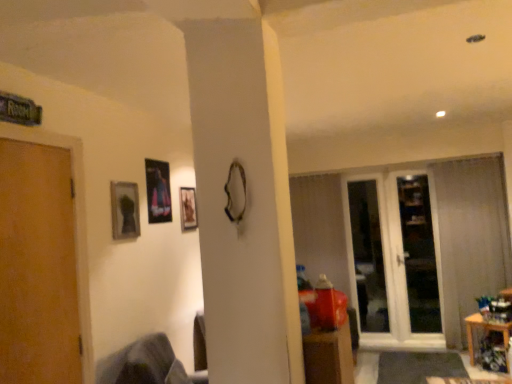
The image size is (512, 384). Describe the element at coordinates (158, 191) in the screenshot. I see `metallic glossy picture frame at upper center, positioned as the 2th picture frame in right-to-left order` at that location.

Where is `wooden table at lower right`? wooden table at lower right is located at coordinates (484, 329).

Describe the element at coordinates (188, 208) in the screenshot. I see `wooden picture frame at center, which is the first picture frame in back-to-front order` at that location.

What do you see at coordinates (391, 262) in the screenshot? I see `transparent glass door at right` at bounding box center [391, 262].

This screenshot has height=384, width=512. What do you see at coordinates (38, 267) in the screenshot?
I see `wooden door at left` at bounding box center [38, 267].

Identify the location of metallic glossy picture frame at upper center, positioned as the 2th picture frame in right-to-left order. The width and height of the screenshot is (512, 384). (158, 191).

Can you tell me how much metallic glossy picture frame at upper center, positioned as the 2th picture frame in right-to-left order, and transparent glass door at right differ in facing direction?

The facing directions of metallic glossy picture frame at upper center, positioned as the 2th picture frame in right-to-left order, and transparent glass door at right are 90 degrees apart.

Is metallic glossy picture frame at upper center, arranged as the second picture frame when viewed from the back, positioned with its back to transparent glass door at right?

No.

Is point (161, 195) in front of point (347, 231)?

Yes, it is.

Is metallic glossy picture frame at upper center, arranged as the second picture frame when viewed from the back, not close to transparent glass door at right?

Yes, metallic glossy picture frame at upper center, arranged as the second picture frame when viewed from the back, is far from transparent glass door at right.

Who is shorter, wooden table at lower right or white plastic screen door at right?

With less height is wooden table at lower right.

Is wooden table at lower right thinner than white plastic screen door at right?

No, wooden table at lower right is not thinner than white plastic screen door at right.

Do you think wooden table at lower right is within white plastic screen door at right, or outside of it?

wooden table at lower right is located beyond the bounds of white plastic screen door at right.

From a real-world perspective, is wooden table at lower right positioned under white plastic screen door at right based on gravity?

Yes, from a real-world perspective, wooden table at lower right is under white plastic screen door at right.

From the image's perspective, would you say white plastic screen door at right is positioned over matte glass picture frame at upper left, which ranks as the first picture frame in left-to-right order?

No.

Between white plastic screen door at right and matte glass picture frame at upper left, the 1th picture frame from the front, which one appears on the right side from the viewer's perspective?

white plastic screen door at right.

Is matte glass picture frame at upper left, the 1th picture frame from the front, surrounded by white plastic screen door at right?

No, matte glass picture frame at upper left, the 1th picture frame from the front, is located outside of white plastic screen door at right.

Which object is closer to the camera taking this photo, wooden table at lower right or metallic glossy picture frame at upper center, which ranks as the second picture frame in front-to-back order?

metallic glossy picture frame at upper center, which ranks as the second picture frame in front-to-back order, is in front.

From a real-world perspective, which object rests below the other?

wooden table at lower right.

Is wooden table at lower right bigger or smaller than metallic glossy picture frame at upper center, which ranks as the second picture frame in front-to-back order?

Considering their sizes, wooden table at lower right takes up more space than metallic glossy picture frame at upper center, which ranks as the second picture frame in front-to-back order.

In terms of width, does wooden picture frame at center, which ranks as the third picture frame in front-to-back order, look wider or thinner when compared to white plastic screen door at right?

Clearly, wooden picture frame at center, which ranks as the third picture frame in front-to-back order, has less width compared to white plastic screen door at right.

Considering the positions of objects wooden picture frame at center, which is the first picture frame in back-to-front order, and white plastic screen door at right in the image provided, who is behind, wooden picture frame at center, which is the first picture frame in back-to-front order, or white plastic screen door at right?

white plastic screen door at right is more distant.

Is point (197, 219) in front of point (366, 259)?

Yes, point (197, 219) is in front of point (366, 259).

Is wooden picture frame at center, positioned as the first picture frame in right-to-left order, facing away from white plastic screen door at right?

No, wooden picture frame at center, positioned as the first picture frame in right-to-left order,'s orientation is not away from white plastic screen door at right.

Which is further, (128, 233) or (153, 184)?

Positioned behind is point (153, 184).

Is matte glass picture frame at upper left, which ranks as the first picture frame in left-to-right order, spatially inside metallic glossy picture frame at upper center, arranged as the second picture frame when viewed from the back, or outside of it?

matte glass picture frame at upper left, which ranks as the first picture frame in left-to-right order, is outside metallic glossy picture frame at upper center, arranged as the second picture frame when viewed from the back.

Can you confirm if matte glass picture frame at upper left, the 1th picture frame from the front, is thinner than metallic glossy picture frame at upper center, the 2th picture frame when ordered from left to right?

In fact, matte glass picture frame at upper left, the 1th picture frame from the front, might be wider than metallic glossy picture frame at upper center, the 2th picture frame when ordered from left to right.

Is matte glass picture frame at upper left, which ranks as the first picture frame in left-to-right order, taller than metallic glossy picture frame at upper center, positioned as the 2th picture frame in right-to-left order?

Incorrect, the height of matte glass picture frame at upper left, which ranks as the first picture frame in left-to-right order, is not larger of that of metallic glossy picture frame at upper center, positioned as the 2th picture frame in right-to-left order.

Considering the points (120, 368) and (116, 202), which point is in front, point (120, 368) or point (116, 202)?

The point (120, 368) is closer.

How much distance is there between dark gray fabric swivel chair at lower left and matte glass picture frame at upper left, which appears as the 3th picture frame when viewed from the back?

dark gray fabric swivel chair at lower left is 30.75 inches from matte glass picture frame at upper left, which appears as the 3th picture frame when viewed from the back.

In the scene shown: From a real-world perspective, which object rests below the other?

dark gray fabric swivel chair at lower left, from a real-world perspective.

Image resolution: width=512 pixels, height=384 pixels. In order to click on swivel chair below the matte glass picture frame at upper left, which is the third picture frame in right-to-left order (from the image's perspective) in this screenshot , I will do `click(146, 364)`.

You are a GUI agent. You are given a task and a screenshot of the screen. Output one action in this format:
    pyautogui.click(x=<x>, y=<y>)
    Task: Click on the 2nd picture frame in front of the transparent glass door at right, starting your count from the anchor
    The image size is (512, 384).
    Given the screenshot: What is the action you would take?
    pyautogui.click(x=158, y=191)

Where is `table lying on the right of white plastic screen door at right`? table lying on the right of white plastic screen door at right is located at coordinates (484, 329).

Which object lies further to the anchor point white plastic screen door at right, dark gray fabric swivel chair at lower left or matte glass picture frame at upper left, the 1th picture frame from the front?

matte glass picture frame at upper left, the 1th picture frame from the front, lies further to white plastic screen door at right than the other object.

Looking at the image, which one is located further to metallic glossy picture frame at upper center, the 2th picture frame when ordered from left to right, wooden door at left or white plastic screen door at right?

white plastic screen door at right.

Looking at this image, considering their positions, is white plastic screen door at right positioned closer to wooden table at lower right than transparent glass door at right?

Among the two, transparent glass door at right is located nearer to wooden table at lower right.

Looking at the image, which one is located closer to wooden picture frame at center, positioned as the first picture frame in right-to-left order, wooden door at left or dark gray fabric swivel chair at lower left?

dark gray fabric swivel chair at lower left is positioned closer to the anchor wooden picture frame at center, positioned as the first picture frame in right-to-left order.

Which object lies nearer to the anchor point metallic glossy picture frame at upper center, the 2th picture frame when ordered from left to right, dark gray fabric swivel chair at lower left or white plastic screen door at right?

dark gray fabric swivel chair at lower left is closer to metallic glossy picture frame at upper center, the 2th picture frame when ordered from left to right.

Which object lies further to the anchor point metallic glossy picture frame at upper center, which ranks as the second picture frame in front-to-back order, transparent glass door at right or wooden table at lower right?

Among the two, wooden table at lower right is located further to metallic glossy picture frame at upper center, which ranks as the second picture frame in front-to-back order.

From the image, which object appears to be nearer to wooden table at lower right, white plastic screen door at right or wooden picture frame at center, positioned as the first picture frame in right-to-left order?

white plastic screen door at right.

When comparing their distances from matte glass picture frame at upper left, which ranks as the first picture frame in left-to-right order, does wooden picture frame at center, which is the third picture frame from left to right, or transparent glass door at right seem further?

transparent glass door at right lies further to matte glass picture frame at upper left, which ranks as the first picture frame in left-to-right order, than the other object.

Find the location of a particular element. The image size is (512, 384). swivel chair located between wooden door at left and wooden picture frame at center, positioned as the first picture frame in right-to-left order, in the depth direction is located at coordinates (146, 364).

Find the location of a particular element. Image resolution: width=512 pixels, height=384 pixels. swivel chair between wooden picture frame at center, which is the third picture frame from left to right, and wooden table at lower right from left to right is located at coordinates (146, 364).

Locate an element on the screen. This screenshot has height=384, width=512. swivel chair between wooden door at left and white plastic screen door at right from front to back is located at coordinates (146, 364).

At what (x,y) coordinates should I click in order to perform the action: click on glass door positioned between wooden door at left and white plastic screen door at right from near to far. Please return your answer as a coordinate pair (x, y). Looking at the image, I should click on (391, 262).